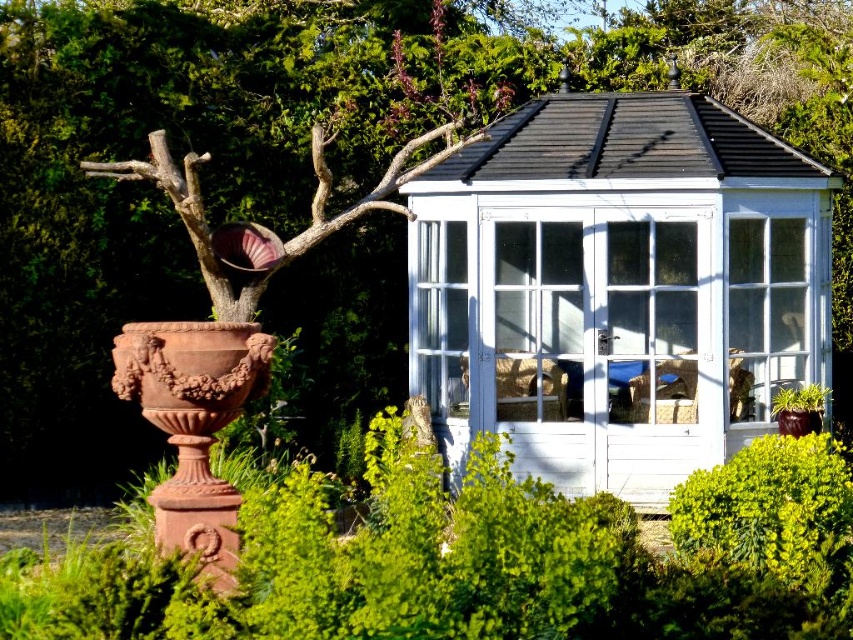
Which is below, white painted wood gazebo at center or clear glass door at center?

Positioned lower is clear glass door at center.

Does white painted wood gazebo at center have a lesser width compared to clear glass door at center?

No, white painted wood gazebo at center is not thinner than clear glass door at center.

Is point (720, 392) in front of point (769, 374)?

Yes, it is in front of point (769, 374).

You are a GUI agent. You are given a task and a screenshot of the screen. Output one action in this format:
    pyautogui.click(x=<x>, y=<y>)
    Task: Click on the white painted wood gazebo at center
    
    Given the screenshot: What is the action you would take?
    pyautogui.click(x=618, y=285)